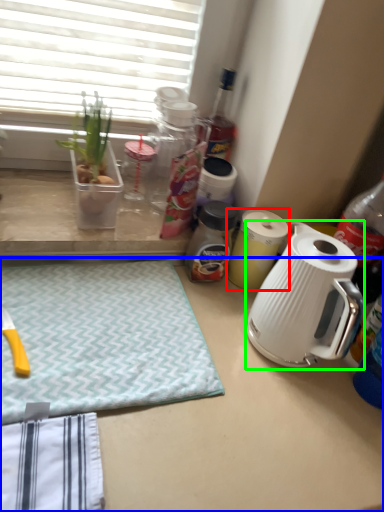
Question: Considering the real-world distances, which object is closest to kitchen appliance (highlighted by a red box)? desk (highlighted by a blue box) or kettle (highlighted by a green box).

Choices:
 (A) desk
 (B) kettle

Answer: (B)